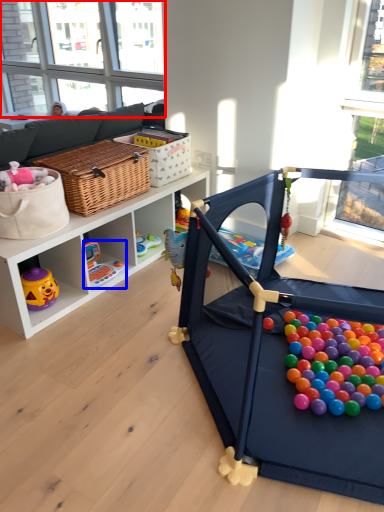
Question: Which object appears farthest to the camera in this image, window screen (highlighted by a red box) or toy (highlighted by a blue box)?

Choices:
 (A) window screen
 (B) toy

Answer: (A)